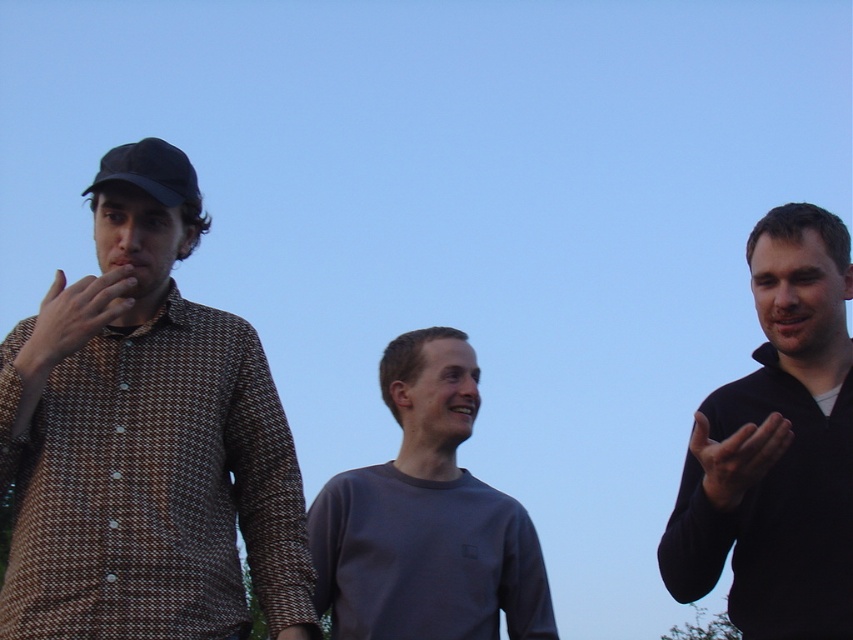
Who is shorter, brown houndstooth shirt at left or black matte hand at right?

Standing shorter between the two is black matte hand at right.

Is brown houndstooth shirt at left above black matte hand at right?

Indeed, brown houndstooth shirt at left is positioned over black matte hand at right.

Does point (144, 241) come closer to viewer compared to point (759, 440)?

No, (144, 241) is further to viewer.

The height and width of the screenshot is (640, 853). In order to click on brown houndstooth shirt at left in this screenshot , I will do `click(144, 438)`.

Is black matte sweater at right to the right of matte brown shirt at left from the viewer's perspective?

Correct, you'll find black matte sweater at right to the right of matte brown shirt at left.

Which is more to the right, black matte sweater at right or matte brown shirt at left?

black matte sweater at right is more to the right.

Who is more forward, (808, 228) or (68, 291)?

Point (68, 291) is in front.

Identify the location of black matte sweater at right. The height and width of the screenshot is (640, 853). (776, 448).

Which of these two, brown houndstooth shirt at left or black matte sweater at right, stands shorter?

black matte sweater at right

The width and height of the screenshot is (853, 640). Describe the element at coordinates (144, 438) in the screenshot. I see `brown houndstooth shirt at left` at that location.

Is point (149, 435) in front of point (808, 570)?

That is True.

The image size is (853, 640). Find the location of `brown houndstooth shirt at left`. brown houndstooth shirt at left is located at coordinates (144, 438).